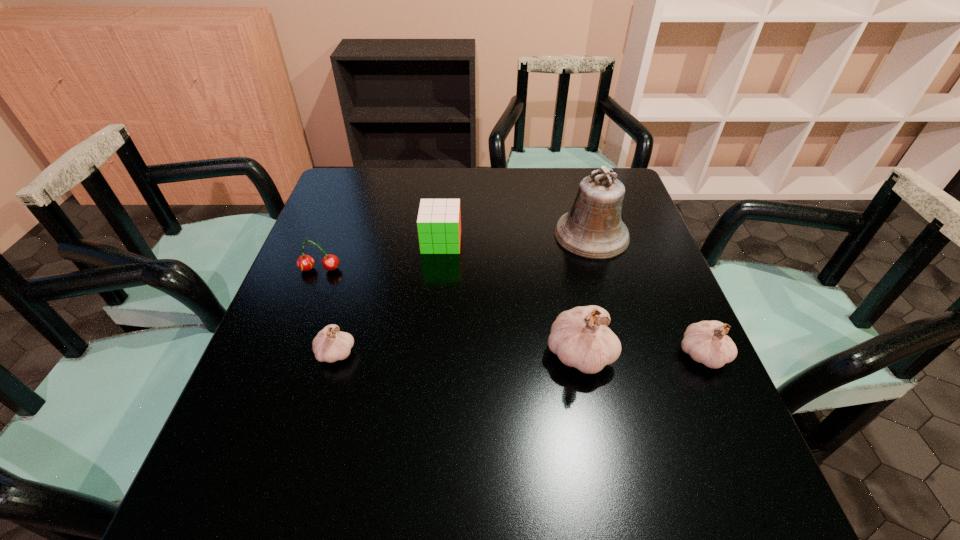
This screenshot has height=540, width=960. Find the location of `the leftmost garlic`. the leftmost garlic is located at coordinates (330, 345).

This screenshot has width=960, height=540. I want to click on the second object from left to right, so click(x=330, y=345).

Where is `the second garlic from left to right`? The height and width of the screenshot is (540, 960). the second garlic from left to right is located at coordinates (580, 337).

Where is `the fifth shortest object`? The width and height of the screenshot is (960, 540). the fifth shortest object is located at coordinates (580, 337).

This screenshot has width=960, height=540. Find the location of `the rightmost garlic`. the rightmost garlic is located at coordinates pos(706,342).

At what (x,y) coordinates should I click in order to perform the action: click on the second shortest garlic. Please return your answer as a coordinate pair (x, y). The width and height of the screenshot is (960, 540). Looking at the image, I should click on (706, 342).

Image resolution: width=960 pixels, height=540 pixels. I want to click on cube, so click(439, 220).

You are a GUI agent. You are given a task and a screenshot of the screen. Output one action in this format:
    pyautogui.click(x=<x>, y=<y>)
    Task: Click on the bell
    
    Given the screenshot: What is the action you would take?
    pyautogui.click(x=593, y=229)

You are a GUI agent. You are given a task and a screenshot of the screen. Output one action in this format:
    pyautogui.click(x=<x>, y=<y>)
    Task: Click on the cherry
    The height and width of the screenshot is (540, 960).
    Given the screenshot: What is the action you would take?
    pyautogui.click(x=330, y=262)

The width and height of the screenshot is (960, 540). I want to click on the leftmost object, so click(x=330, y=262).